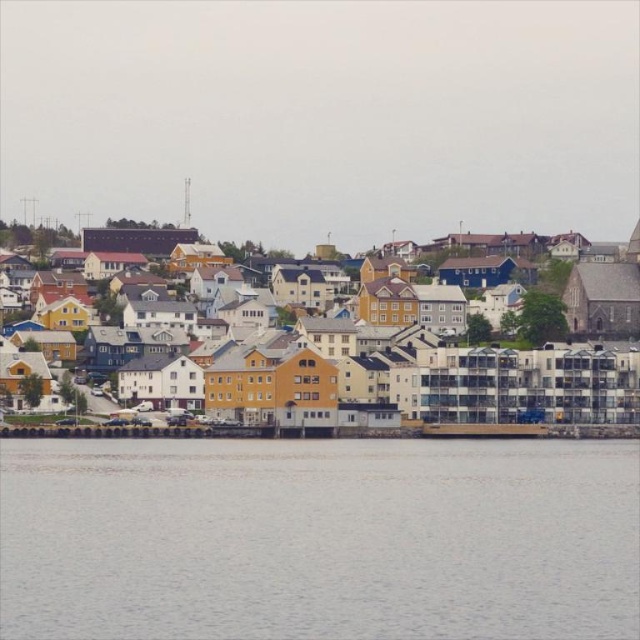
Question: Is the position of gray water at lower center more distant than that of yellow matte building at center?

Choices:
 (A) no
 (B) yes

Answer: (A)

Question: Where is gray water at lower center located in relation to yellow matte building at center in the image?

Choices:
 (A) left
 (B) right

Answer: (A)

Question: Which of the following is the closest to the observer?

Choices:
 (A) (492, 596)
 (B) (401, 344)

Answer: (A)

Question: Where is gray water at lower center located in relation to yellow matte building at center in the image?

Choices:
 (A) below
 (B) above

Answer: (A)

Question: Which object is closer to the camera taking this photo?

Choices:
 (A) gray water at lower center
 (B) yellow matte building at center

Answer: (A)